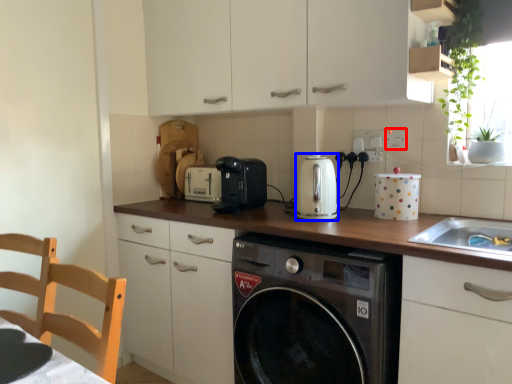
Question: Which of the following is the farthest to the observer, electric outlet (highlighted by a red box) or kitchen appliance (highlighted by a blue box)?

Choices:
 (A) electric outlet
 (B) kitchen appliance

Answer: (A)